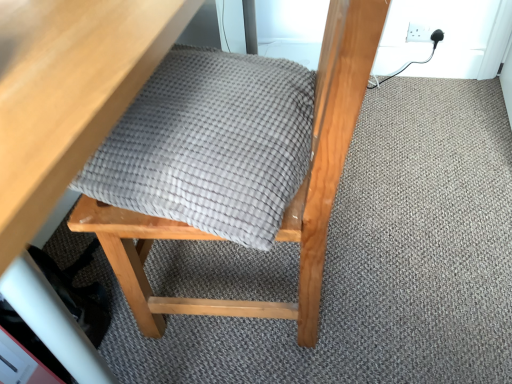
Question: From a real-world perspective, is matte gray cushion at center above or below white plastic socket at upper right?

Choices:
 (A) above
 (B) below

Answer: (A)

Question: Considering the relative positions of matte gray cushion at center and white plastic socket at upper right in the image provided, is matte gray cushion at center to the left or to the right of white plastic socket at upper right?

Choices:
 (A) left
 (B) right

Answer: (A)

Question: Estimate the real-world distances between objects in this image. Which object is closer to the wooden table at upper left?

Choices:
 (A) white plastic socket at upper right
 (B) gray woven blanket at center
 (C) matte gray cushion at center

Answer: (B)

Question: Based on their relative distances, which object is nearer to the wooden table at upper left?

Choices:
 (A) white plastic socket at upper right
 (B) gray woven blanket at center
 (C) matte gray cushion at center

Answer: (B)